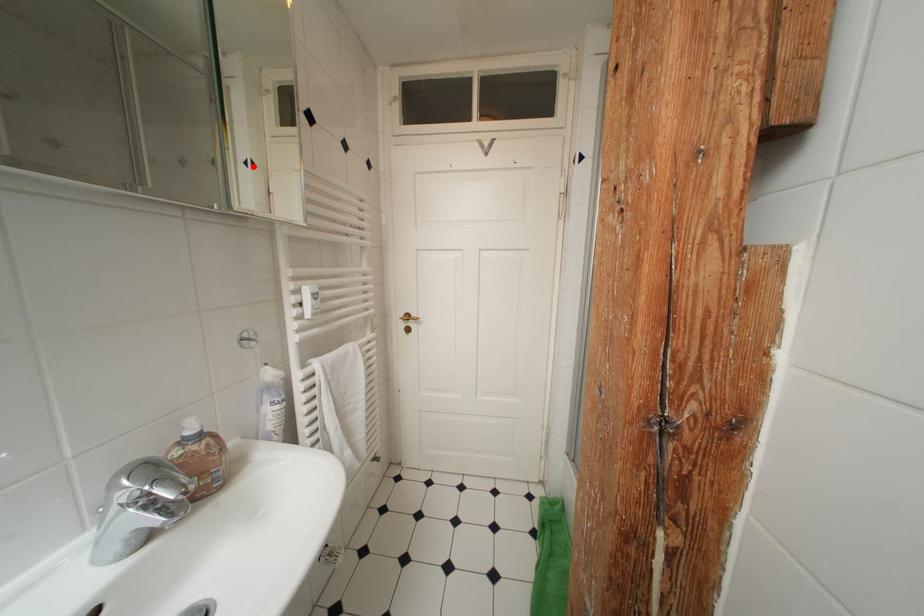
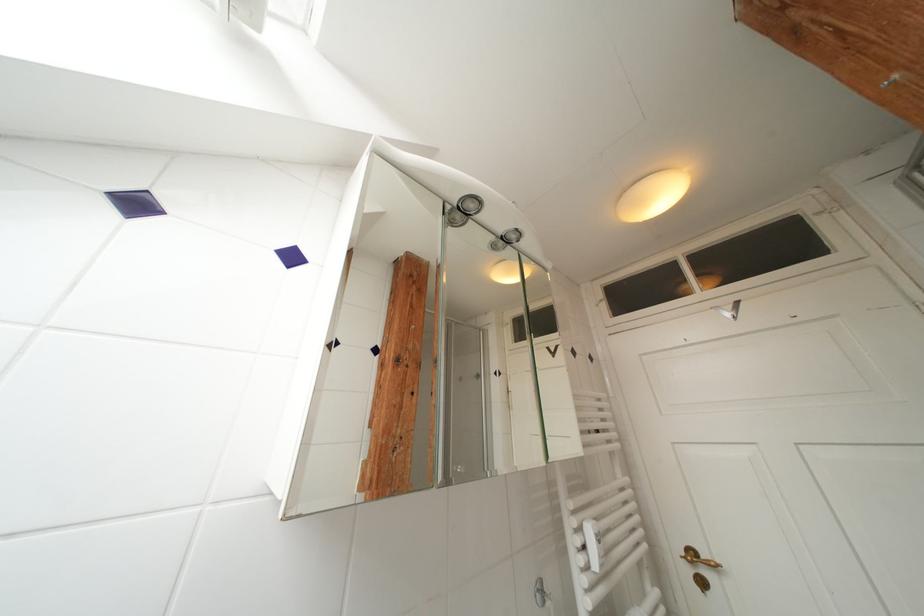
Question: I am providing you with two images of the same scene from different viewpoints. In image1, a red point is highlighted. Considering the same 3D point in image2, which of the following is correct?

Choices:
 (A) It is closer
 (B) It is farther

Answer: (B)